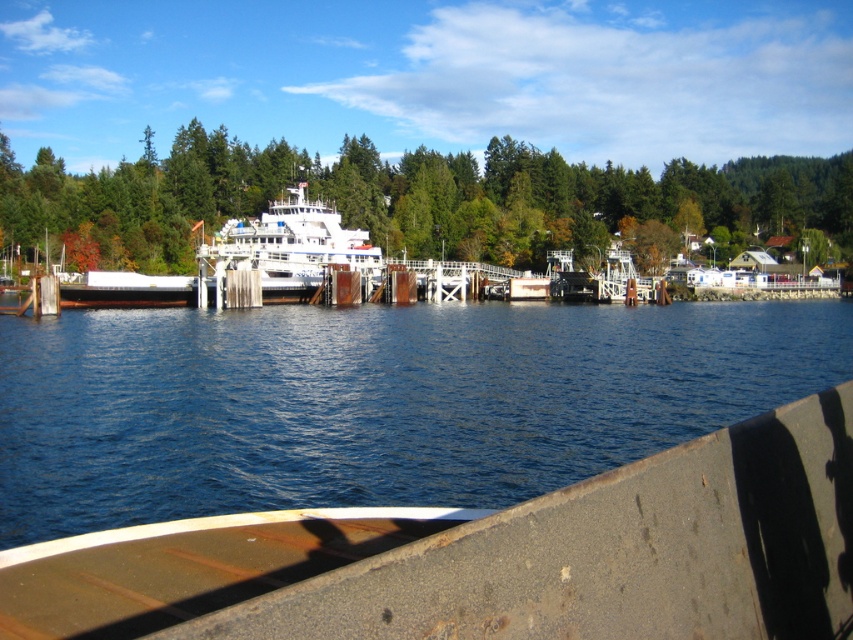
Question: Based on their relative distances, which object is nearer to the blue water at center?

Choices:
 (A) green matte tree at center
 (B) white glossy ferry at center

Answer: (B)

Question: Does blue water at center have a lesser width compared to green matte tree at center?

Choices:
 (A) no
 (B) yes

Answer: (B)

Question: Among these points, which one is nearest to the camera?

Choices:
 (A) (496, 440)
 (B) (154, 236)
 (C) (213, 262)

Answer: (A)

Question: Can you confirm if blue water at center is smaller than green matte tree at center?

Choices:
 (A) no
 (B) yes

Answer: (B)

Question: Which of the following is the closest to the observer?

Choices:
 (A) (461, 204)
 (B) (96, 490)
 (C) (271, 250)

Answer: (B)

Question: Observing the image, what is the correct spatial positioning of blue water at center in reference to white glossy ferry at center?

Choices:
 (A) right
 (B) left

Answer: (A)